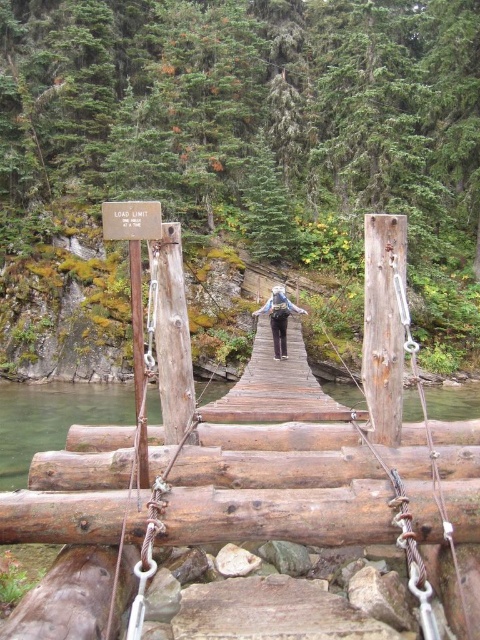
Can you confirm if brown wooden bridge at center is taller than matte gray backpack at center?

Yes.

Measure the distance between brown wooden bridge at center and camera.

brown wooden bridge at center and camera are 13.37 feet apart.

Find the location of a particular element. brown wooden bridge at center is located at coordinates (250, 465).

Is greenish-brown wood at center wider than matte gray backpack at center?

Yes.

Between greenish-brown wood at center and matte gray backpack at center, which one is positioned higher?

matte gray backpack at center

Does point (470, 416) come farther from viewer compared to point (283, 288)?

Yes, point (470, 416) is behind point (283, 288).

What are the coordinates of `greenish-brown wood at center` in the screenshot? It's located at (51, 419).

Who is lower down, brown wooden bridge at center or greenish-brown wood at center?

greenish-brown wood at center is lower down.

Can you confirm if brown wooden bridge at center is positioned to the left of greenish-brown wood at center?

In fact, brown wooden bridge at center is to the right of greenish-brown wood at center.

Find the location of `brown wooden bridge at center`. brown wooden bridge at center is located at coordinates (250, 465).